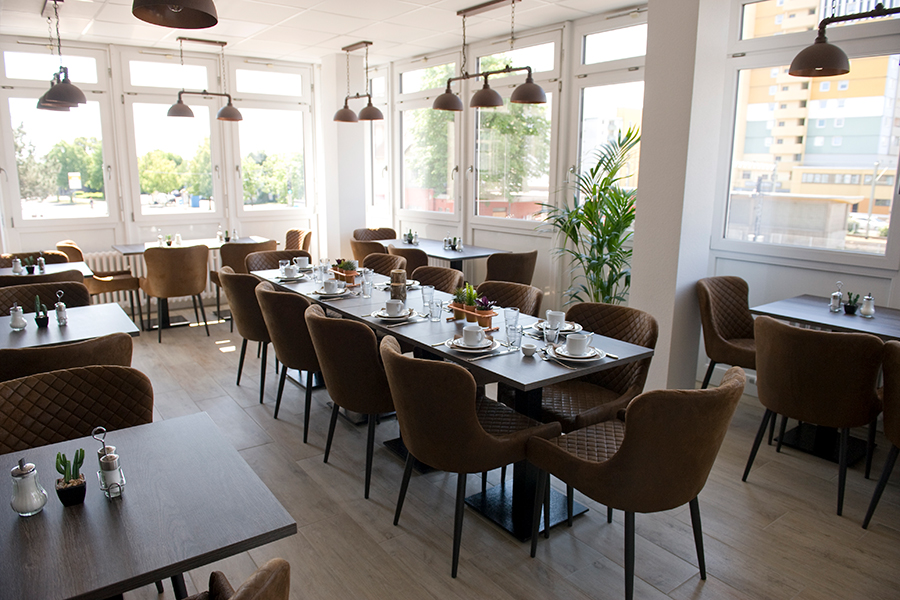
Where is `clear drinking glasses`? clear drinking glasses is located at coordinates (546, 335), (511, 336), (507, 316), (435, 308), (424, 290), (366, 287), (365, 274), (313, 272), (280, 263), (326, 262).